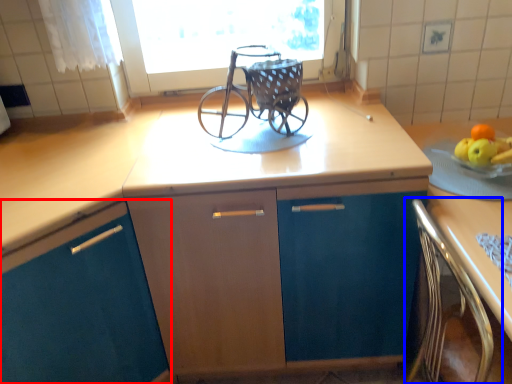
Question: Which object is closer to the camera taking this photo, cabinetry (highlighted by a red box) or chair (highlighted by a blue box)?

Choices:
 (A) cabinetry
 (B) chair

Answer: (B)